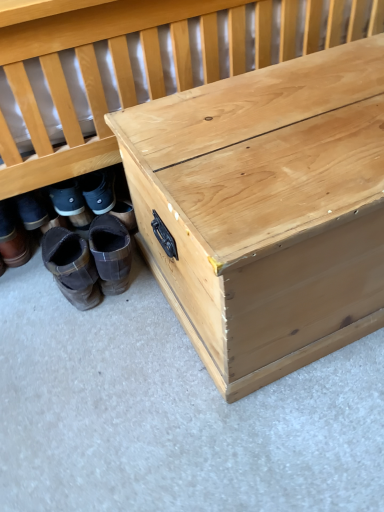
What do you see at coordinates (12, 238) in the screenshot? I see `brown suede boots at lower left, the first footwear from the left` at bounding box center [12, 238].

In order to face brown suede boots at lower left, the 3th footwear in the left-to-right sequence, should I rotate leftwards or rightwards?

Rotate left and turn 11.429 degrees.

Where is `brown suede boots at lower left, the 3th footwear in the left-to-right sequence`? brown suede boots at lower left, the 3th footwear in the left-to-right sequence is located at coordinates (111, 253).

This screenshot has width=384, height=512. In order to click on brown suede boots at lower left, the 2th footwear positioned from the left in this screenshot , I will do `click(72, 267)`.

Consider the image. Considering the sizes of brown suede boots at lower left, the first footwear from the left, and natural wood trunk at lower right in the image, is brown suede boots at lower left, the first footwear from the left, wider or thinner than natural wood trunk at lower right?

Considering their sizes, brown suede boots at lower left, the first footwear from the left, looks slimmer than natural wood trunk at lower right.

Could you tell me if brown suede boots at lower left, the first footwear from the left, is facing natural wood trunk at lower right?

Yes, brown suede boots at lower left, the first footwear from the left, is aimed at natural wood trunk at lower right.

From the image's perspective, is brown suede boots at lower left, positioned as the third footwear in right-to-left order, below natural wood trunk at lower right?

Yes, from the image's perspective, brown suede boots at lower left, positioned as the third footwear in right-to-left order, is below natural wood trunk at lower right.

Does point (24, 238) appear closer or farther from the camera than point (56, 170)?

Point (24, 238).

Does natural wood trunk at center turn towards brown suede boots at lower left, the 3th footwear in the left-to-right sequence?

No, natural wood trunk at center is not facing towards brown suede boots at lower left, the 3th footwear in the left-to-right sequence.

In terms of size, does natural wood trunk at center appear bigger or smaller than brown suede boots at lower left, the 3th footwear in the left-to-right sequence?

Clearly, natural wood trunk at center is larger in size than brown suede boots at lower left, the 3th footwear in the left-to-right sequence.

Between point (317, 264) and point (111, 246), which one is positioned in front?

The point (317, 264) is in front.

From the image's perspective, which is above, natural wood trunk at center or brown suede boots at lower left, which ranks as the first footwear in right-to-left order?

natural wood trunk at center, from the image's perspective.

Is brown suede boots at lower left, the first footwear from the left, wider or thinner than brown suede boots at lower left, which ranks as the first footwear in right-to-left order?

brown suede boots at lower left, the first footwear from the left, is thinner than brown suede boots at lower left, which ranks as the first footwear in right-to-left order.

Does brown suede boots at lower left, the first footwear from the left, have a larger size compared to brown suede boots at lower left, which ranks as the first footwear in right-to-left order?

Yes, brown suede boots at lower left, the first footwear from the left, is bigger than brown suede boots at lower left, which ranks as the first footwear in right-to-left order.

From a real-world perspective, is brown suede boots at lower left, positioned as the third footwear in right-to-left order, above or below brown suede boots at lower left, which ranks as the first footwear in right-to-left order?

brown suede boots at lower left, positioned as the third footwear in right-to-left order, is situated higher than brown suede boots at lower left, which ranks as the first footwear in right-to-left order, in the real world.

Between brown suede boots at lower left, positioned as the third footwear in right-to-left order, and brown suede boots at lower left, the 3th footwear in the left-to-right sequence, which one has less height?

With less height is brown suede boots at lower left, the 3th footwear in the left-to-right sequence.

From the image's perspective, relative to brown suede boots at lower left, the 2th footwear positioned from the left, is brown suede boots at lower left, which ranks as the first footwear in right-to-left order, above or below?

From the image's perspective, brown suede boots at lower left, which ranks as the first footwear in right-to-left order, appears above brown suede boots at lower left, the 2th footwear positioned from the left.

Which object is positioned more to the right, brown suede boots at lower left, the 3th footwear in the left-to-right sequence, or brown suede boots at lower left, the 2th footwear viewed from the right?

Positioned to the right is brown suede boots at lower left, the 3th footwear in the left-to-right sequence.

Considering the sizes of brown suede boots at lower left, which ranks as the first footwear in right-to-left order, and brown suede boots at lower left, the 2th footwear positioned from the left, in the image, is brown suede boots at lower left, which ranks as the first footwear in right-to-left order, wider or thinner than brown suede boots at lower left, the 2th footwear positioned from the left,?

Considering their sizes, brown suede boots at lower left, which ranks as the first footwear in right-to-left order, looks slimmer than brown suede boots at lower left, the 2th footwear positioned from the left.

Which of these two, brown suede boots at lower left, which ranks as the first footwear in right-to-left order, or brown suede boots at lower left, the 2th footwear viewed from the right, stands taller?

brown suede boots at lower left, which ranks as the first footwear in right-to-left order.

At what (x,y) coordinates should I click in order to perform the action: click on table above the brown suede boots at lower left, the first footwear from the left (from the image's perspective). Please return your answer as a coordinate pair (x, y). This screenshot has width=384, height=512. Looking at the image, I should click on (266, 210).

Considering the relative sizes of brown suede boots at lower left, the first footwear from the left, and natural wood trunk at center in the image provided, is brown suede boots at lower left, the first footwear from the left, bigger than natural wood trunk at center?

Actually, brown suede boots at lower left, the first footwear from the left, might be smaller than natural wood trunk at center.

Consider the image. Which object is thinner, brown suede boots at lower left, the first footwear from the left, or natural wood trunk at center?

Thinner between the two is brown suede boots at lower left, the first footwear from the left.

Where is `infant bed lying in front of the brown suede boots at lower left, the 2th footwear positioned from the left`? The width and height of the screenshot is (384, 512). infant bed lying in front of the brown suede boots at lower left, the 2th footwear positioned from the left is located at coordinates (101, 76).

Considering the positions of point (94, 285) and point (168, 23), is point (94, 285) closer or farther from the camera than point (168, 23)?

Point (94, 285).

From the image's perspective, which is below, brown suede boots at lower left, the 2th footwear viewed from the right, or natural wood trunk at lower right?

From the image's view, brown suede boots at lower left, the 2th footwear viewed from the right, is below.

Consider the image. Is brown suede boots at lower left, the 2th footwear viewed from the right, oriented towards natural wood trunk at lower right?

Yes.

Is natural wood trunk at lower right not inside brown suede boots at lower left, the 3th footwear in the left-to-right sequence?

natural wood trunk at lower right is positioned outside brown suede boots at lower left, the 3th footwear in the left-to-right sequence.

Is natural wood trunk at lower right behind brown suede boots at lower left, which ranks as the first footwear in right-to-left order?

No, it is in front of brown suede boots at lower left, which ranks as the first footwear in right-to-left order.

Is natural wood trunk at lower right touching brown suede boots at lower left, which ranks as the first footwear in right-to-left order?

natural wood trunk at lower right and brown suede boots at lower left, which ranks as the first footwear in right-to-left order, are not in contact.

Considering the relative sizes of natural wood trunk at lower right and brown suede boots at lower left, which ranks as the first footwear in right-to-left order, in the image provided, is natural wood trunk at lower right taller than brown suede boots at lower left, which ranks as the first footwear in right-to-left order,?

Yes, natural wood trunk at lower right is taller than brown suede boots at lower left, which ranks as the first footwear in right-to-left order.

Where is `footwear that is the 3rd object to the left of the natural wood trunk at lower right, starting at the anchor`? The height and width of the screenshot is (512, 384). footwear that is the 3rd object to the left of the natural wood trunk at lower right, starting at the anchor is located at coordinates [x=12, y=238].

Which footwear is the 2nd one when counting from the back of the natural wood trunk at center? Please provide its 2D coordinates.

[(111, 253)]

Looking at the image, which one is located further to natural wood trunk at center, natural wood trunk at lower right or brown suede boots at lower left, the 3th footwear in the left-to-right sequence?

brown suede boots at lower left, the 3th footwear in the left-to-right sequence, is positioned further to the anchor natural wood trunk at center.

Estimate the real-world distances between objects in this image. Which object is further from brown suede boots at lower left, the first footwear from the left, natural wood trunk at lower right or natural wood trunk at center?

The object further to brown suede boots at lower left, the first footwear from the left, is natural wood trunk at center.

From the image, which object appears to be nearer to natural wood trunk at lower right, brown suede boots at lower left, the 2th footwear positioned from the left, or natural wood trunk at center?

natural wood trunk at center.

Based on the photo, estimate the real-world distances between objects in this image. Which object is further from brown suede boots at lower left, positioned as the third footwear in right-to-left order, natural wood trunk at lower right or brown suede boots at lower left, which ranks as the first footwear in right-to-left order?

The object further to brown suede boots at lower left, positioned as the third footwear in right-to-left order, is natural wood trunk at lower right.

When comparing their distances from brown suede boots at lower left, the 2th footwear positioned from the left, does natural wood trunk at center or brown suede boots at lower left, which ranks as the first footwear in right-to-left order, seem closer?

A: brown suede boots at lower left, which ranks as the first footwear in right-to-left order, is positioned closer to the anchor brown suede boots at lower left, the 2th footwear positioned from the left.

Looking at the image, which one is located closer to brown suede boots at lower left, which ranks as the first footwear in right-to-left order, natural wood trunk at center or natural wood trunk at lower right?

natural wood trunk at lower right is positioned closer to the anchor brown suede boots at lower left, which ranks as the first footwear in right-to-left order.

From the image, which object appears to be farther from brown suede boots at lower left, the 2th footwear viewed from the right, brown suede boots at lower left, the first footwear from the left, or brown suede boots at lower left, which ranks as the first footwear in right-to-left order?

brown suede boots at lower left, the first footwear from the left, lies further to brown suede boots at lower left, the 2th footwear viewed from the right, than the other object.

Based on their spatial positions, is brown suede boots at lower left, which ranks as the first footwear in right-to-left order, or natural wood trunk at lower right closer to natural wood trunk at center?

natural wood trunk at lower right.

Where is `table that lies between natural wood trunk at lower right and brown suede boots at lower left, which ranks as the first footwear in right-to-left order, from top to bottom`? table that lies between natural wood trunk at lower right and brown suede boots at lower left, which ranks as the first footwear in right-to-left order, from top to bottom is located at coordinates (266, 210).

Locate an element on the screen. This screenshot has width=384, height=512. footwear between natural wood trunk at lower right and brown suede boots at lower left, which ranks as the first footwear in right-to-left order, vertically is located at coordinates (12, 238).

Identify the location of footwear located between brown suede boots at lower left, the 2th footwear viewed from the right, and natural wood trunk at center in the left-right direction. Image resolution: width=384 pixels, height=512 pixels. (111, 253).

Identify the location of table that lies between natural wood trunk at lower right and brown suede boots at lower left, the 2th footwear viewed from the right, from top to bottom. The width and height of the screenshot is (384, 512). (266, 210).